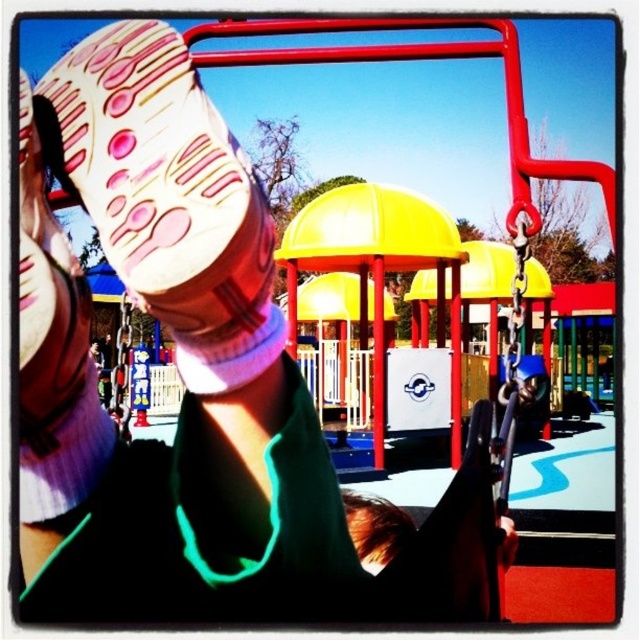
You are a child at the playground and see the pink fabric sock at upper left and the brown hair at lower center. Which object is located more to the left side?

The pink fabric sock at upper left is more on the left side.

You are a photographer setting up for a group photo at the playground. You notice the pink fabric sock at upper left and the brown hair at lower center. Which object should you position closer to the camera to ensure both are clearly visible in the photo?

The pink fabric sock at upper left is wider than the brown hair at lower center, so positioning the pink fabric sock at upper left closer to the camera will help maintain clarity for both objects.

You are a photographer trying to capture a photo of the brown hair at lower center without the pink fabric sock at upper left blocking the view. Can you adjust your position to do so?

The pink fabric sock at upper left is closer to the viewer than brown hair at lower center, so adjusting your position might allow you to angle the camera so the pink fabric sock at upper left no longer blocks the view of the brown hair at lower center.